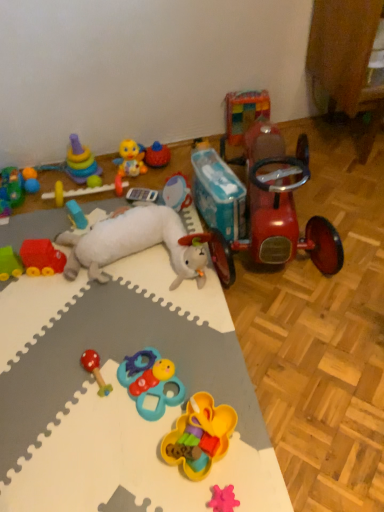
Where is `vacant area to the left of wooden/matte rattle at lower left, marked as the 9th toy in a right-to-left arrangement`? This screenshot has height=512, width=384. vacant area to the left of wooden/matte rattle at lower left, marked as the 9th toy in a right-to-left arrangement is located at coordinates (43, 383).